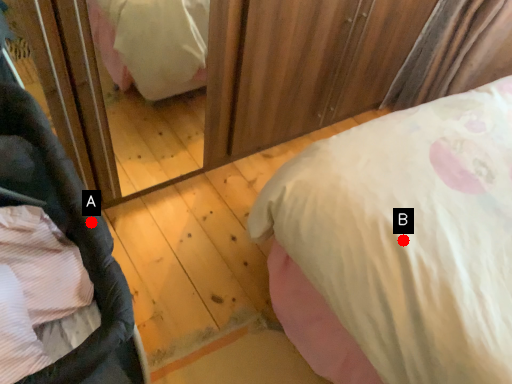
Question: Two points are circled on the image, labeled by A and B beside each circle. Among these points, which one is nearest to the camera?

Choices:
 (A) A is closer
 (B) B is closer

Answer: (A)